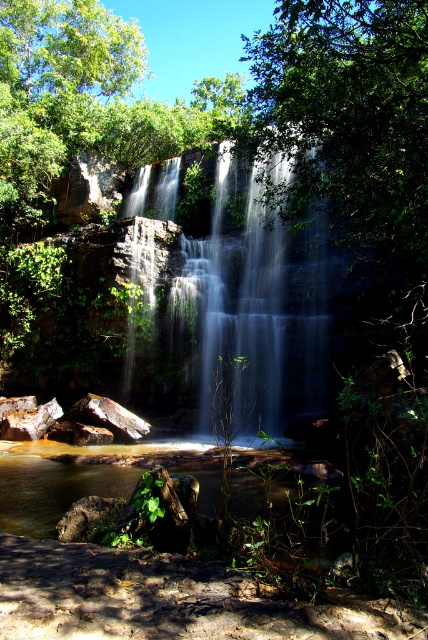
Who is more distant from viewer, [275,280] or [44,516]?

Positioned behind is point [275,280].

Is translucent white water at center shorter than clear water at center?

No, translucent white water at center is not shorter than clear water at center.

Is point (192, 296) positioned behind point (38, 500)?

Yes, it is.

Where is `translucent white water at center`? This screenshot has height=640, width=428. translucent white water at center is located at coordinates (256, 305).